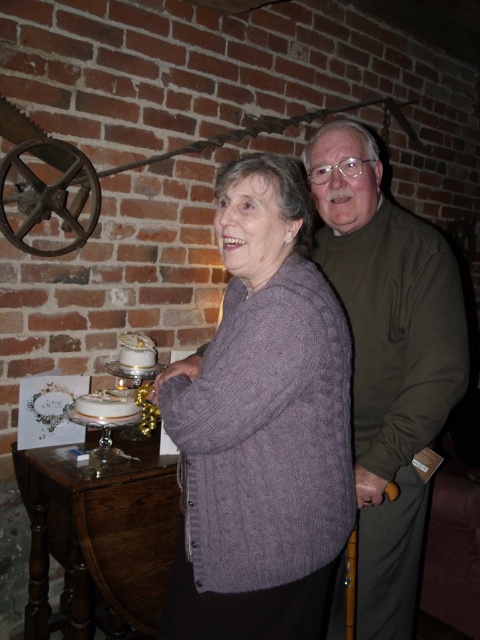
Is point (324, 412) closer to camera compared to point (424, 504)?

Yes, it is in front of point (424, 504).

Is purple knitted sweater at center below olive green sweater at center?

Correct, purple knitted sweater at center is located below olive green sweater at center.

Which is in front, point (316, 493) or point (420, 252)?

Positioned in front is point (316, 493).

Locate an element on the screen. Image resolution: width=480 pixels, height=640 pixels. purple knitted sweater at center is located at coordinates (262, 426).

Looking at this image, who is taller, olive green sweater at center or white glossy cake at lower left?

olive green sweater at center

Between point (448, 324) and point (111, 408), which one is positioned behind?

The point (111, 408) is behind.

Does point (374, 388) come farther from viewer compared to point (95, 404)?

No, it is not.

You are a GUI agent. You are given a task and a screenshot of the screen. Output one action in this format:
    pyautogui.click(x=<x>, y=<y>)
    Task: Click on the olive green sweater at center
    The image size is (480, 640).
    Given the screenshot: What is the action you would take?
    pyautogui.click(x=387, y=358)

Is point (286, 637) closer to viewer compared to point (131, 396)?

Yes, point (286, 637) is in front of point (131, 396).

Does purple knitted sweater at center lie in front of white glossy cake at lower left?

That is True.

Describe the element at coordinates (262, 426) in the screenshot. This screenshot has width=480, height=640. I see `purple knitted sweater at center` at that location.

Identify the location of purple knitted sweater at center. (262, 426).